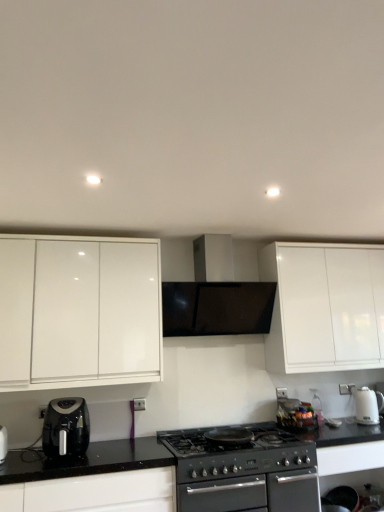
Question: Considering the relative sizes of black matte stove at center and black matte range hood at center in the image provided, is black matte stove at center taller than black matte range hood at center?

Choices:
 (A) no
 (B) yes

Answer: (A)

Question: Is black matte stove at center turned away from black matte range hood at center?

Choices:
 (A) no
 (B) yes

Answer: (A)

Question: Can you confirm if black matte stove at center is positioned to the right of black matte range hood at center?

Choices:
 (A) yes
 (B) no

Answer: (A)

Question: Can we say black matte stove at center lies outside black matte range hood at center?

Choices:
 (A) yes
 (B) no

Answer: (A)

Question: From the image's perspective, is black matte stove at center on top of black matte range hood at center?

Choices:
 (A) no
 (B) yes

Answer: (A)

Question: Does black matte stove at center contain black matte range hood at center?

Choices:
 (A) yes
 (B) no

Answer: (B)

Question: Is black plastic air fryer at lower left, placed as the 1th kitchen appliance when sorted from left to right, outside white glossy cabinet at left?

Choices:
 (A) no
 (B) yes

Answer: (B)

Question: Is black plastic air fryer at lower left, the 2th kitchen appliance in the back-to-front sequence, not close to white glossy cabinet at left?

Choices:
 (A) yes
 (B) no

Answer: (B)

Question: From the image's perspective, is black plastic air fryer at lower left, positioned as the second kitchen appliance in right-to-left order, beneath white glossy cabinet at left?

Choices:
 (A) yes
 (B) no

Answer: (A)

Question: Is black plastic air fryer at lower left, positioned as the second kitchen appliance in right-to-left order, to the left of white glossy cabinet at left from the viewer's perspective?

Choices:
 (A) no
 (B) yes

Answer: (A)

Question: Does black plastic air fryer at lower left, the 2th kitchen appliance in the back-to-front sequence, have a larger size compared to white glossy cabinet at left?

Choices:
 (A) yes
 (B) no

Answer: (B)

Question: From the image's perspective, is black plastic air fryer at lower left, positioned as the second kitchen appliance in right-to-left order, on white glossy cabinet at left?

Choices:
 (A) no
 (B) yes

Answer: (A)

Question: Could you tell me if black plastic air fryer at lower left, the 2th kitchen appliance in the back-to-front sequence, is facing white glossy electric kettle at right, the second kitchen appliance viewed from the front?

Choices:
 (A) yes
 (B) no

Answer: (B)